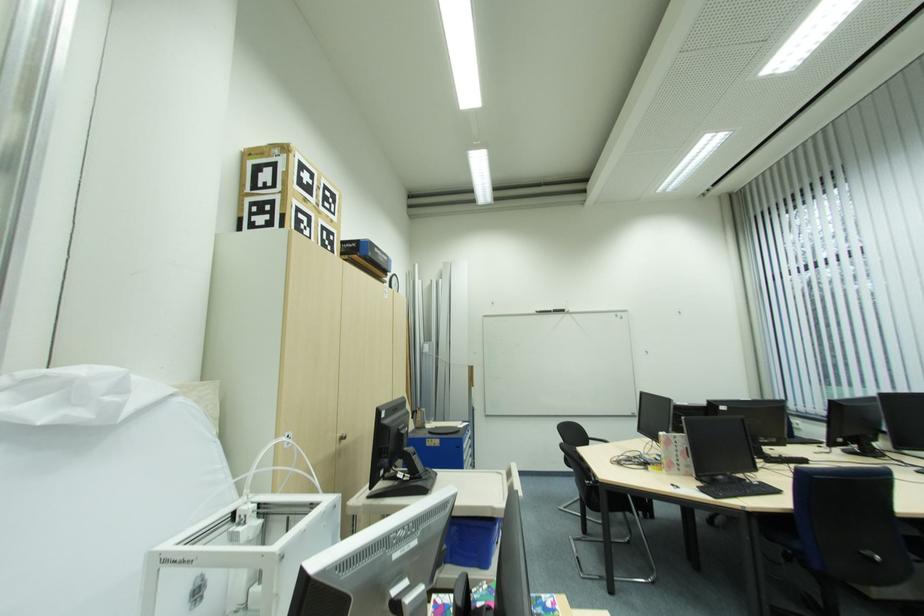
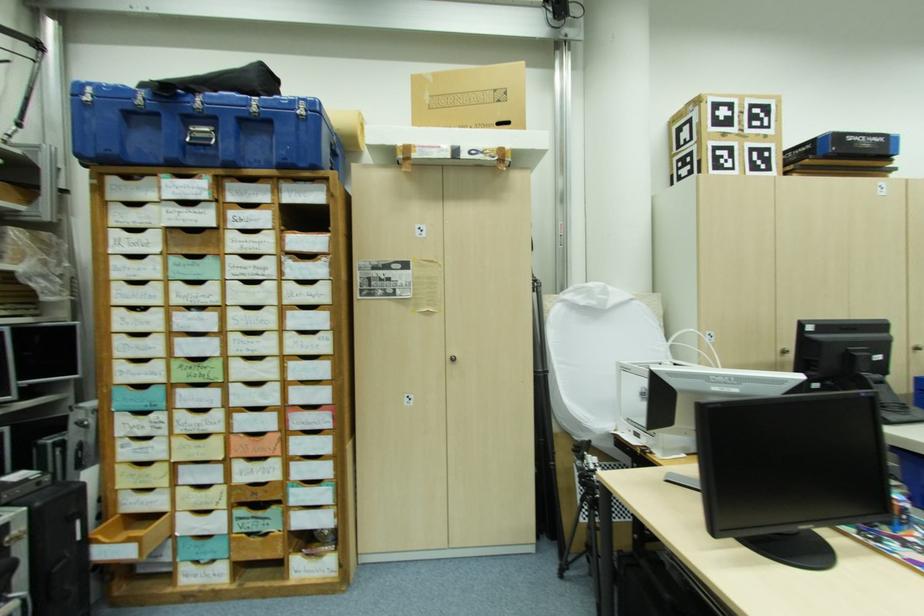
Question: The camera is either moving clockwise (left) or counter-clockwise (right) around the object. The first image is from the beginning of the video and the second image is from the end. Is the camera moving left or right when shooting the video?

Choices:
 (A) Left
 (B) Right

Answer: (B)